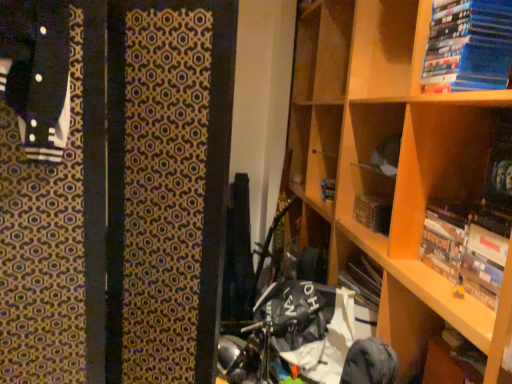
Question: Is wooden bookshelf at upper right located outside blue matte book at upper right, acting as the second book starting from the bottom?

Choices:
 (A) no
 (B) yes

Answer: (B)

Question: Considering the relative sizes of wooden bookshelf at upper right and blue matte book at upper right, acting as the second book starting from the bottom, in the image provided, is wooden bookshelf at upper right taller than blue matte book at upper right, acting as the second book starting from the bottom,?

Choices:
 (A) no
 (B) yes

Answer: (B)

Question: Does wooden bookshelf at upper right have a greater width compared to blue matte book at upper right, acting as the second book starting from the bottom?

Choices:
 (A) no
 (B) yes

Answer: (B)

Question: From the image's perspective, is wooden bookshelf at upper right under blue matte book at upper right, marked as the 1th book in a top-to-bottom arrangement?

Choices:
 (A) yes
 (B) no

Answer: (A)

Question: Is wooden bookshelf at upper right at the right side of blue matte book at upper right, acting as the second book starting from the bottom?

Choices:
 (A) yes
 (B) no

Answer: (B)

Question: In terms of height, does blue matte book at upper right, marked as the 1th book in a top-to-bottom arrangement, look taller or shorter compared to hardcover book at center?

Choices:
 (A) short
 (B) tall

Answer: (B)

Question: Is blue matte book at upper right, marked as the 1th book in a top-to-bottom arrangement, in front of or behind hardcover book at center in the image?

Choices:
 (A) behind
 (B) front

Answer: (B)

Question: From the image's perspective, is blue matte book at upper right, marked as the 1th book in a top-to-bottom arrangement, positioned above or below hardcover book at center?

Choices:
 (A) above
 (B) below

Answer: (A)

Question: Is blue matte book at upper right, marked as the 1th book in a top-to-bottom arrangement, inside the boundaries of hardcover book at center, or outside?

Choices:
 (A) inside
 (B) outside

Answer: (B)

Question: Which is correct: wooden bookshelf at upper right is inside hardcover book at center, or outside of it?

Choices:
 (A) outside
 (B) inside

Answer: (A)

Question: Would you say wooden bookshelf at upper right is to the left or to the right of hardcover book at center in the picture?

Choices:
 (A) left
 (B) right

Answer: (B)

Question: Considering the positions of point (334, 180) and point (378, 215), is point (334, 180) closer or farther from the camera than point (378, 215)?

Choices:
 (A) farther
 (B) closer

Answer: (A)

Question: Based on their sizes in the image, would you say wooden bookshelf at upper right is bigger or smaller than hardcover book at center?

Choices:
 (A) small
 (B) big

Answer: (B)

Question: In the image, is hardcover book at upper right, positioned as the second book in top-to-bottom order, positioned in front of or behind blue matte book at upper right, marked as the 1th book in a top-to-bottom arrangement?

Choices:
 (A) front
 (B) behind

Answer: (B)

Question: Based on their sizes in the image, would you say hardcover book at upper right, the first book in the bottom-to-top sequence, is bigger or smaller than blue matte book at upper right, marked as the 1th book in a top-to-bottom arrangement?

Choices:
 (A) big
 (B) small

Answer: (B)